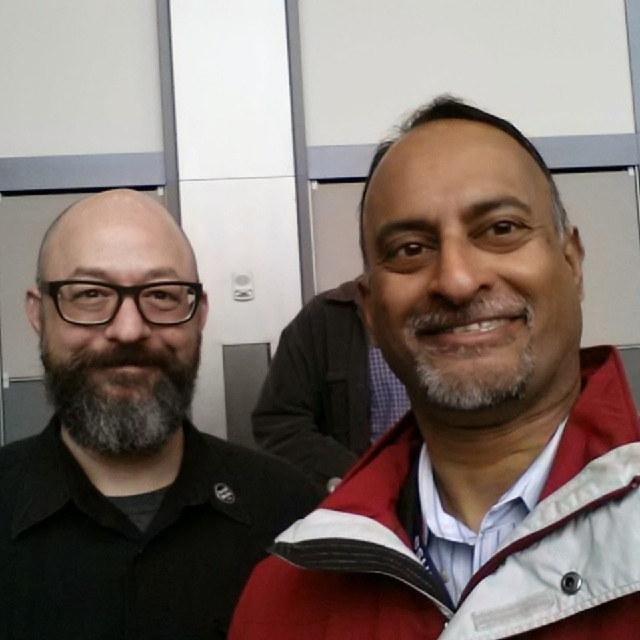
Question: Is matte black shirt at left above gray matte beard at center?

Choices:
 (A) yes
 (B) no

Answer: (B)

Question: Which of these objects is positioned farthest from the gray matte beard at left?

Choices:
 (A) red woolen jacket at center
 (B) red fleece jacket at center

Answer: (A)

Question: Which of the following is the closest to the observer?

Choices:
 (A) matte black shirt at left
 (B) gray matte beard at center

Answer: (B)

Question: Is red woolen jacket at center bigger than gray matte beard at center?

Choices:
 (A) no
 (B) yes

Answer: (B)

Question: Does red woolen jacket at center lie behind gray matte beard at left?

Choices:
 (A) no
 (B) yes

Answer: (B)

Question: Which is nearer to the matte black shirt at left?

Choices:
 (A) gray matte beard at center
 (B) gray matte beard at left
 (C) red fleece jacket at center

Answer: (B)